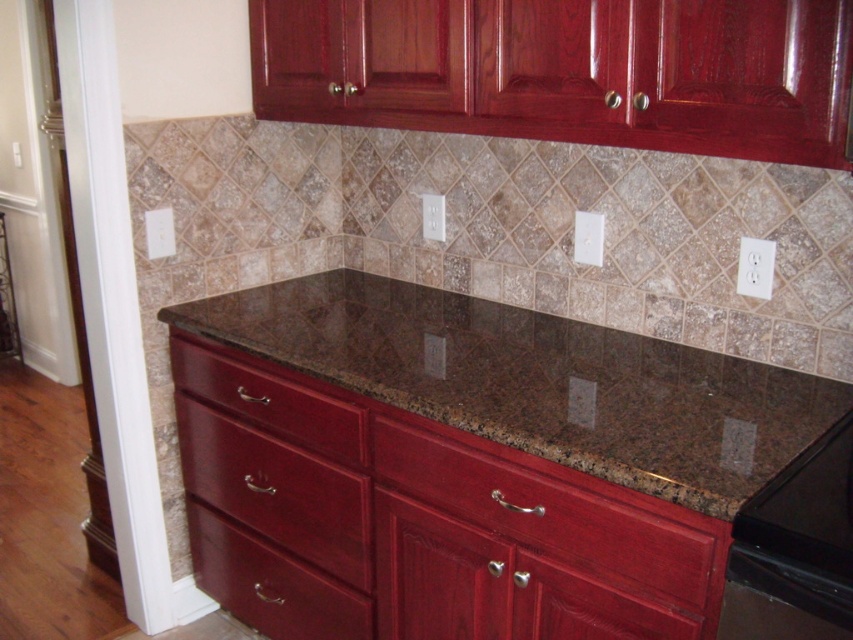
Question: Which object appears closest to the camera in this image?

Choices:
 (A) glossy wood cabinets at upper center
 (B) black granite stove at lower right
 (C) glossy wood drawer at lower left
 (D) glossy wood drawer at lower center

Answer: (B)

Question: Among these points, which one is nearest to the camera?

Choices:
 (A) (547, 330)
 (B) (753, 604)
 (C) (358, 554)

Answer: (B)

Question: Among these objects, which one is nearest to the camera?

Choices:
 (A) black granite stove at lower right
 (B) matte wood drawer at center
 (C) glossy wood drawer at lower left

Answer: (A)

Question: Does matte wood drawer at center appear on the left side of glossy wood drawer at lower center?

Choices:
 (A) yes
 (B) no

Answer: (B)

Question: Is glossy wood cabinets at upper center smaller than brown granite countertop at center?

Choices:
 (A) yes
 (B) no

Answer: (A)

Question: Can you confirm if matte wood drawer at center is positioned to the left of black granite stove at lower right?

Choices:
 (A) yes
 (B) no

Answer: (A)